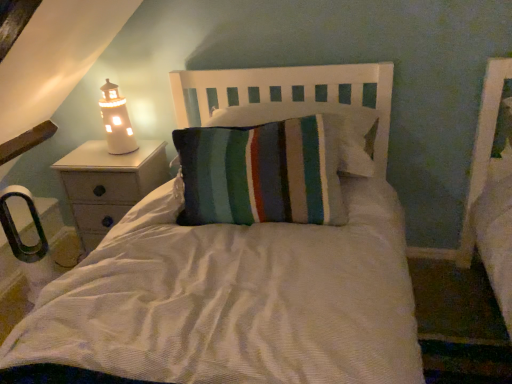
Question: Considering the positions of point (264, 97) and point (96, 145), is point (264, 97) closer or farther from the camera than point (96, 145)?

Choices:
 (A) farther
 (B) closer

Answer: (B)

Question: Would you say white wood headboard at center is to the left or to the right of white wood nightstand at left in the picture?

Choices:
 (A) right
 (B) left

Answer: (A)

Question: Based on their relative distances, which object is nearer to the white wood nightstand at left?

Choices:
 (A) white wood headboard at center
 (B) white ceramic lighthouse at left

Answer: (B)

Question: Which object is the closest to the white ceramic lighthouse at left?

Choices:
 (A) white wood headboard at center
 (B) white wood nightstand at left

Answer: (B)